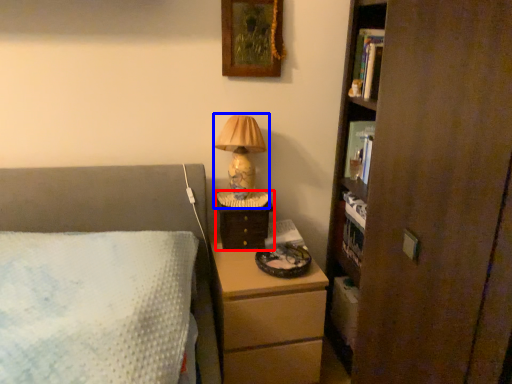
Question: Among these objects, which one is farthest to the camera, nightstand (highlighted by a red box) or table lamp (highlighted by a blue box)?

Choices:
 (A) nightstand
 (B) table lamp

Answer: (A)